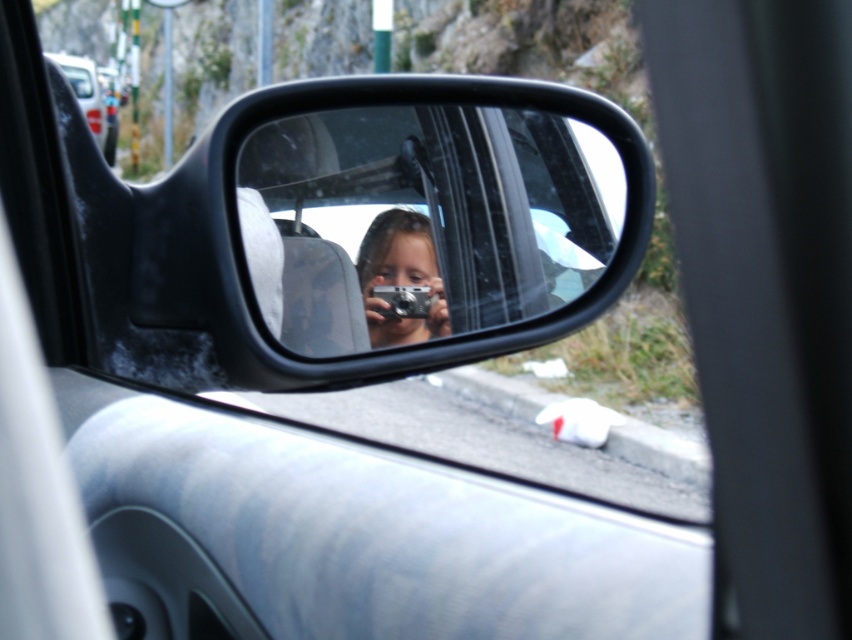
You are a photographer trying to capture a reflection in the clear plastic mirror at center. You notice the metallic silver car at upper left is blocking part of the mirror. Can you shift your position to the right to get a better view of the mirror without the car obstructing it?

The clear plastic mirror at center is to the right of the metallic silver car at upper left, so moving to the right would position you further away from the car, potentially reducing its obstruction and allowing a clearer view of the mirror.

You are trying to decide whether to place the matte silver camera at center on top of the metallic silver car at upper left. Based on their sizes, do you think the camera will fit without overhanging?

The matte silver camera at center is smaller than the metallic silver car at upper left, so it should fit without overhanging.